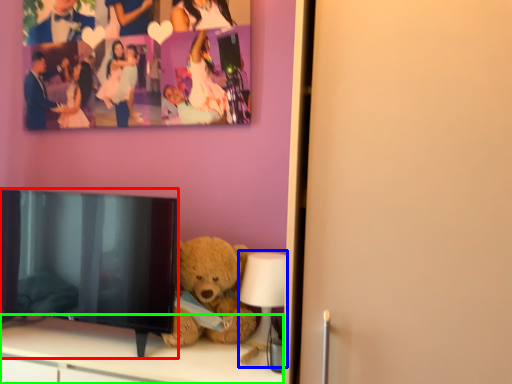
Question: Estimate the real-world distances between objects in this image. Which object is closer to television (highlighted by a red box), lamp (highlighted by a blue box) or furniture (highlighted by a green box)?

Choices:
 (A) lamp
 (B) furniture

Answer: (B)